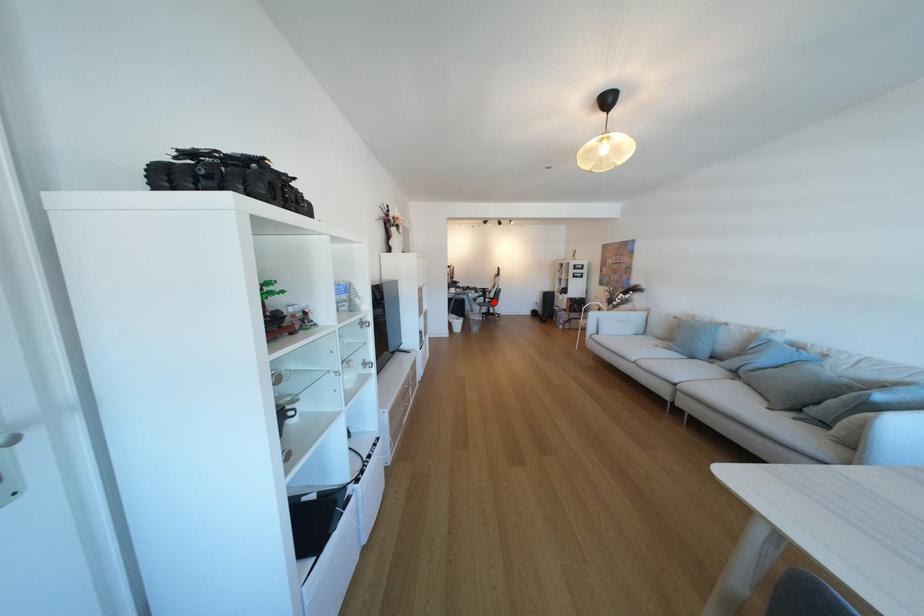
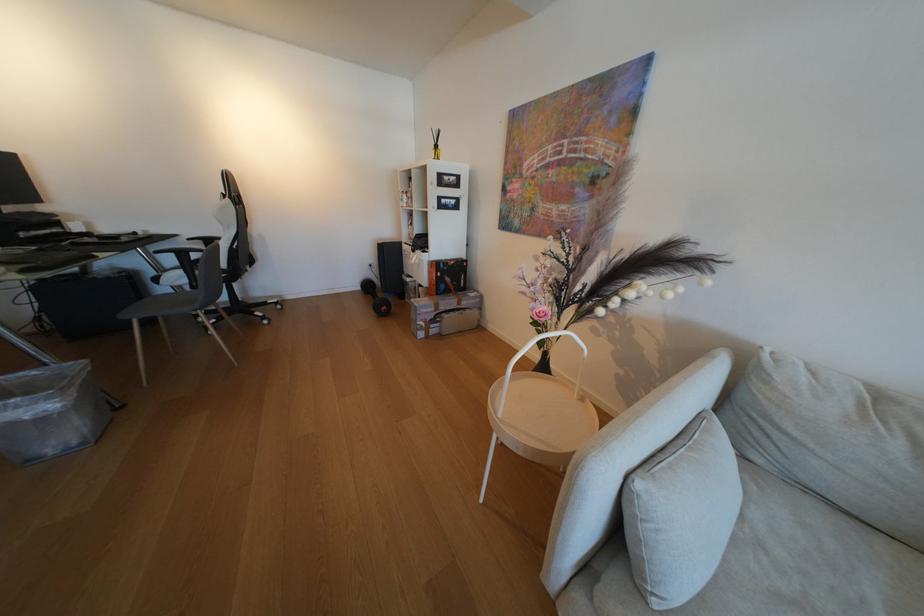
Question: A red point is marked in image1. In image2, is the corresponding 3D point closer to the camera or farther? Reply with the corresponding letter.

Choices:
 (A) The corresponding 3D point is closer.
 (B) The corresponding 3D point is farther.

Answer: (B)